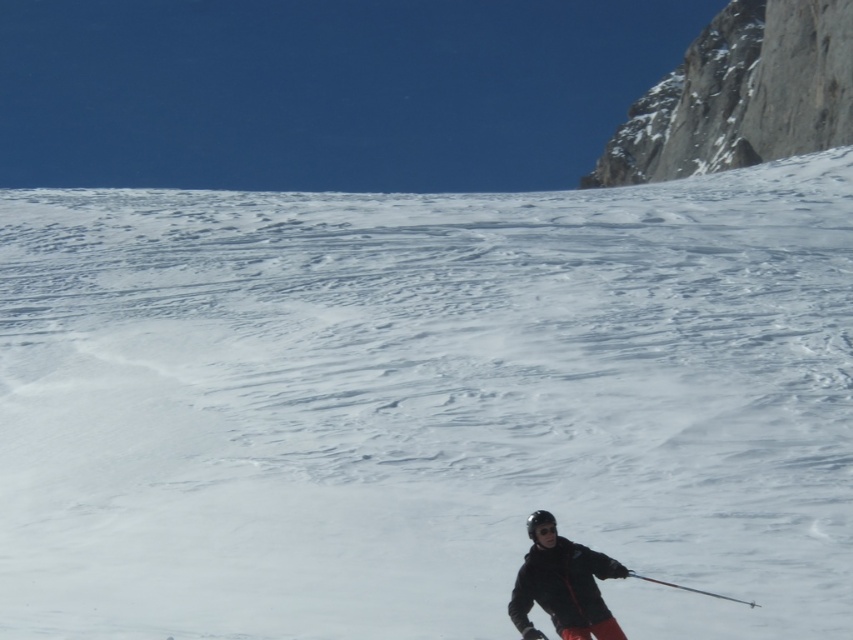
Question: Does rocky cliff at upper right appear on the left side of black matte jacket at lower right?

Choices:
 (A) yes
 (B) no

Answer: (B)

Question: Is rocky cliff at upper right to the left of black matte jacket at lower right from the viewer's perspective?

Choices:
 (A) yes
 (B) no

Answer: (B)

Question: Which object is closer to the camera taking this photo?

Choices:
 (A) rocky cliff at upper right
 (B) black matte jacket at lower right

Answer: (B)

Question: Which object is closer to the camera taking this photo?

Choices:
 (A) black matte jacket at lower right
 (B) rocky cliff at upper right

Answer: (A)

Question: Can you confirm if rocky cliff at upper right is smaller than black matte jacket at lower right?

Choices:
 (A) yes
 (B) no

Answer: (B)